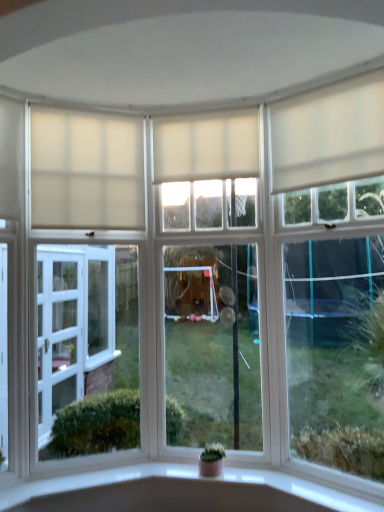
Question: Considering the relative sizes of green matte houseplant at center and white matte curtain at center, which ranks as the 2th curtain in left-to-right order, in the image provided, is green matte houseplant at center smaller than white matte curtain at center, which ranks as the 2th curtain in left-to-right order,?

Choices:
 (A) yes
 (B) no

Answer: (A)

Question: Would you say green matte houseplant at center is a long distance from white matte curtain at center, placed as the 2th curtain when sorted from right to left?

Choices:
 (A) no
 (B) yes

Answer: (B)

Question: Is green matte houseplant at center oriented towards white matte curtain at center, placed as the 2th curtain when sorted from right to left?

Choices:
 (A) yes
 (B) no

Answer: (B)

Question: From a real-world perspective, does green matte houseplant at center stand above white matte curtain at center, placed as the 2th curtain when sorted from right to left?

Choices:
 (A) no
 (B) yes

Answer: (A)

Question: From the image's perspective, is green matte houseplant at center above white matte curtain at center, which ranks as the 2th curtain in left-to-right order?

Choices:
 (A) yes
 (B) no

Answer: (B)

Question: Does green matte houseplant at center have a larger size compared to white matte curtain at center, which ranks as the 2th curtain in left-to-right order?

Choices:
 (A) yes
 (B) no

Answer: (B)

Question: From a real-world perspective, does white matte curtain at upper right, the 3th curtain when ordered from left to right, stand above green matte houseplant at center?

Choices:
 (A) yes
 (B) no

Answer: (A)

Question: From the image's perspective, does white matte curtain at upper right, the 1th curtain positioned from the right, appear higher than green matte houseplant at center?

Choices:
 (A) no
 (B) yes

Answer: (B)

Question: Can you confirm if white matte curtain at upper right, the 1th curtain positioned from the right, is bigger than green matte houseplant at center?

Choices:
 (A) no
 (B) yes

Answer: (B)

Question: Considering the relative sizes of white matte curtain at upper right, the 1th curtain positioned from the right, and green matte houseplant at center in the image provided, is white matte curtain at upper right, the 1th curtain positioned from the right, wider than green matte houseplant at center?

Choices:
 (A) yes
 (B) no

Answer: (B)

Question: Can you see white matte curtain at upper right, the 1th curtain positioned from the right, touching green matte houseplant at center?

Choices:
 (A) no
 (B) yes

Answer: (A)

Question: Is white matte curtain at upper right, the 1th curtain positioned from the right, oriented towards green matte houseplant at center?

Choices:
 (A) yes
 (B) no

Answer: (B)

Question: Is green matte houseplant at center outside white matte curtain at upper center, which is the first curtain from left to right?

Choices:
 (A) yes
 (B) no

Answer: (A)